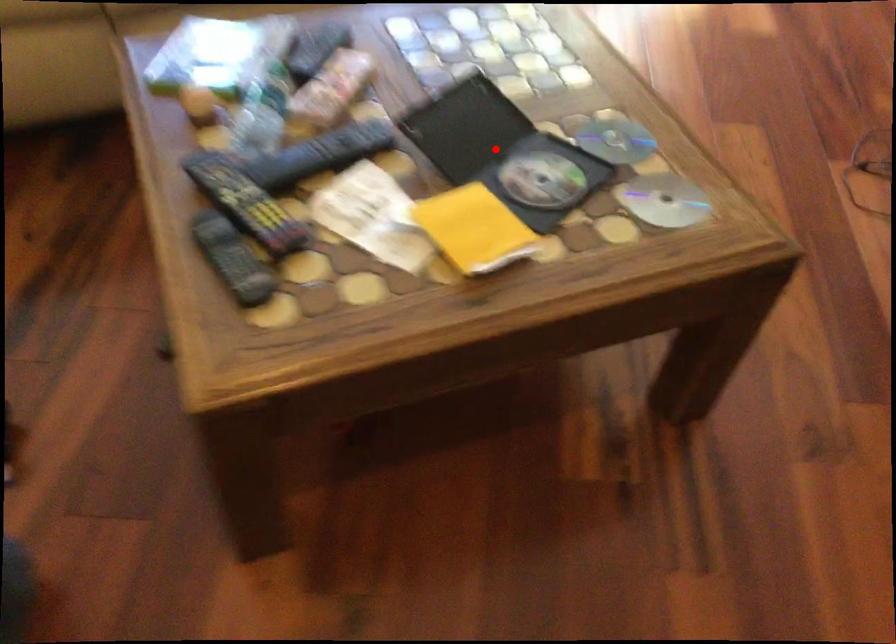
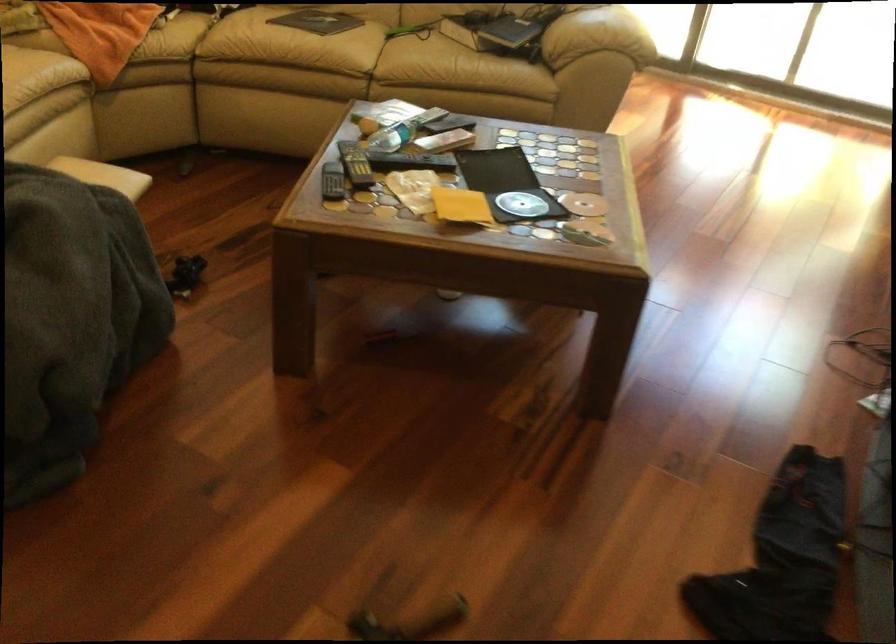
Where in the second image is the point corresponding to the highlighted location from the first image?

(506, 184)